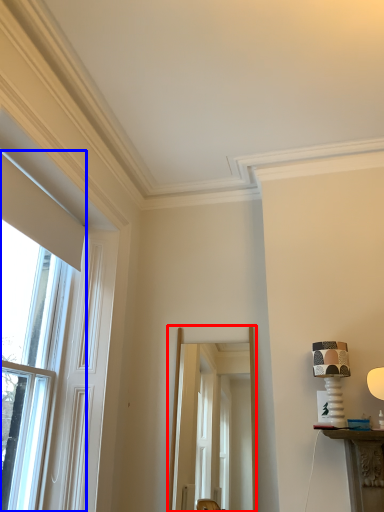
Question: Which point is further to the camera, screen door (highlighted by a red box) or window (highlighted by a blue box)?

Choices:
 (A) screen door
 (B) window

Answer: (A)